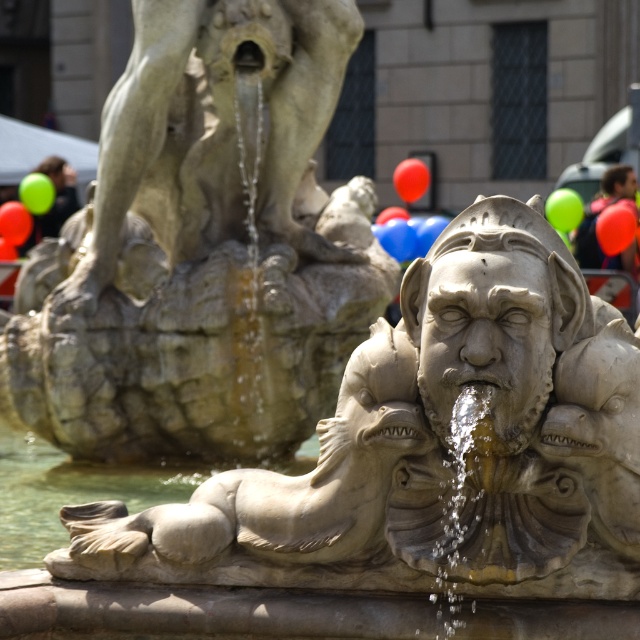
Question: Does stone fountain at center have a greater width compared to blurred hair at center?

Choices:
 (A) yes
 (B) no

Answer: (A)

Question: Is stone fountain at center smaller than blurred hair at center?

Choices:
 (A) no
 (B) yes

Answer: (A)

Question: Which object appears farthest from the camera in this image?

Choices:
 (A) stone fountain at center
 (B) blurred hair at center

Answer: (B)

Question: Which point is farther from the camera taking this photo?

Choices:
 (A) (86, 392)
 (B) (586, 257)

Answer: (B)

Question: Does stone fountain at center appear under blurred hair at center?

Choices:
 (A) no
 (B) yes

Answer: (B)